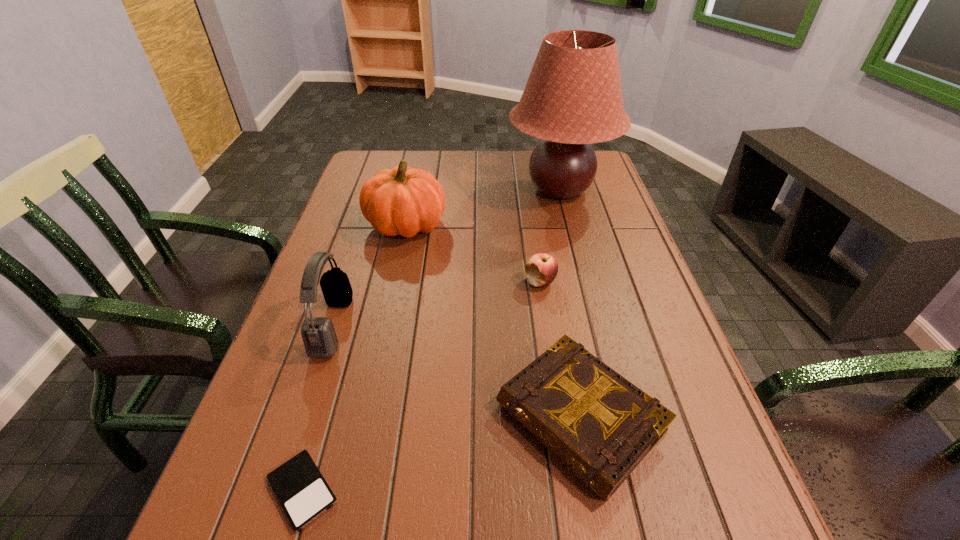
The image size is (960, 540). In order to click on free space between the iPod and the apple in this screenshot , I will do `click(421, 386)`.

Locate an element on the screen. The height and width of the screenshot is (540, 960). vacant space that is in between the pumpkin and the headset is located at coordinates (370, 275).

Locate an element on the screen. The width and height of the screenshot is (960, 540). vacant space in between the third farthest object and the pumpkin is located at coordinates (473, 253).

Identify which object is the second closest to the headset. Please provide its 2D coordinates. Your answer should be formatted as a tuple, i.e. [(x, y)], where the tuple contains the x and y coordinates of a point satisfying the conditions above.

[(301, 489)]

Where is `object that is the fifth closest to the pumpkin`? This screenshot has width=960, height=540. object that is the fifth closest to the pumpkin is located at coordinates (301, 489).

Identify the location of vacant space that satisfies the following two spatial constraints: 1. on the headband of the hardback book; 2. on the right side of the headset. (302, 418).

Where is `blank space that satisfies the following two spatial constraints: 1. on the front side of the apple; 2. on the headband of the headset`? blank space that satisfies the following two spatial constraints: 1. on the front side of the apple; 2. on the headband of the headset is located at coordinates (546, 326).

Where is `free space that satisfies the following two spatial constraints: 1. on the front-facing side of the tallest object; 2. on the headband of the headset`? free space that satisfies the following two spatial constraints: 1. on the front-facing side of the tallest object; 2. on the headband of the headset is located at coordinates (594, 326).